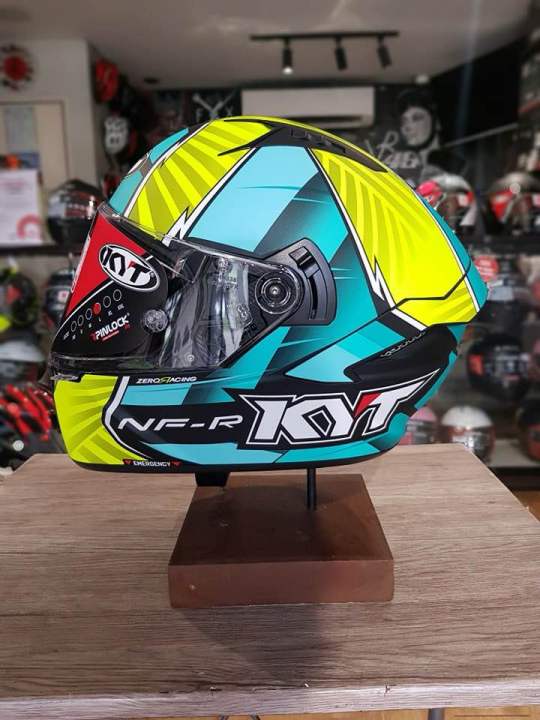
This screenshot has width=540, height=720. Find the location of `wooden table`. wooden table is located at coordinates (435, 590).